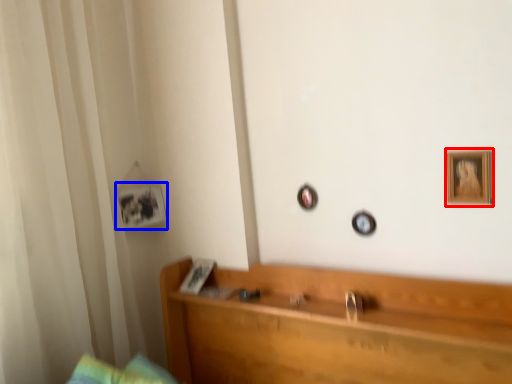
Question: Which of the following is the farthest to the observer, picture frame (highlighted by a red box) or picture frame (highlighted by a blue box)?

Choices:
 (A) picture frame
 (B) picture frame

Answer: (B)